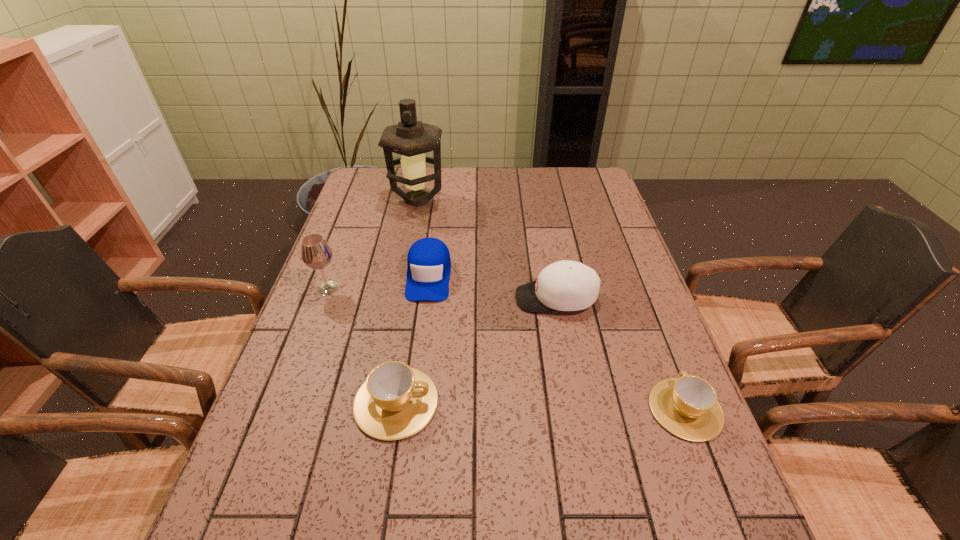
Where is `object that is the closest to the left baseball cap`? object that is the closest to the left baseball cap is located at coordinates (316, 253).

Identify which object is the fifth nearest to the left cup. Please provide its 2D coordinates. Your answer should be formatted as a tuple, i.e. [(x, y)], where the tuple contains the x and y coordinates of a point satisfying the conditions above.

[(410, 138)]

Identify the location of blank area in the image that satisfies the following two spatial constraints: 1. on the front-facing side of the fourth shortest object; 2. with the handle on the side of the rightmost object. (576, 409).

At what (x,y) coordinates should I click in order to perform the action: click on free space that satisfies the following two spatial constraints: 1. with the handle on the side of the taller cup; 2. with the handle on the side of the rightmost object. Please return your answer as a coordinate pair (x, y). This screenshot has height=540, width=960. Looking at the image, I should click on (396, 409).